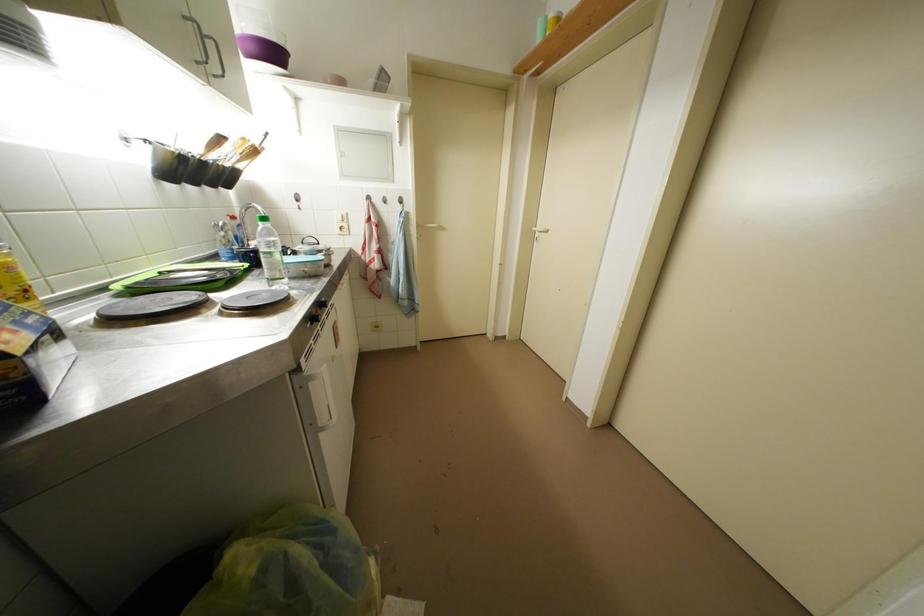
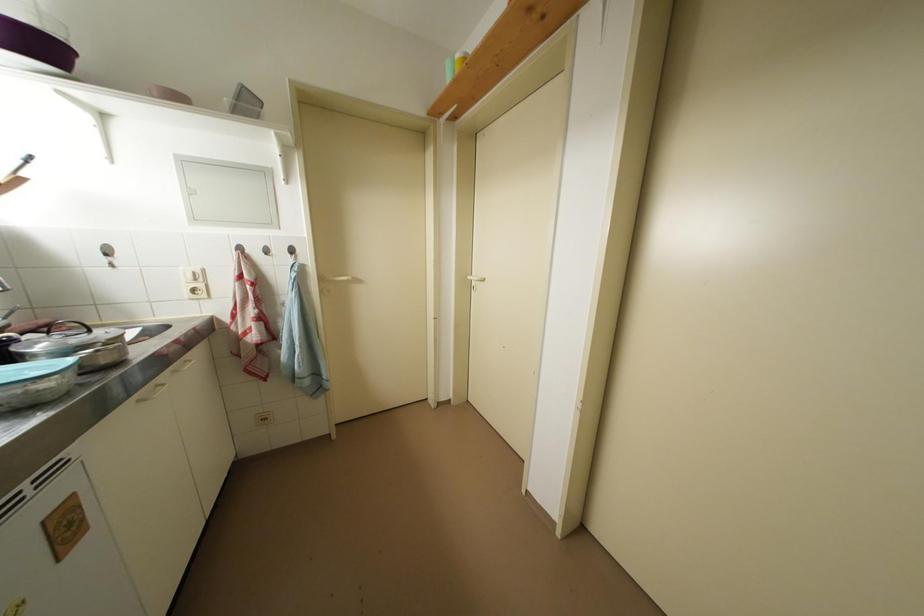
In a continuous first-person perspective shot, in which direction is the camera moving?

The cameraman moved toward right, forward.